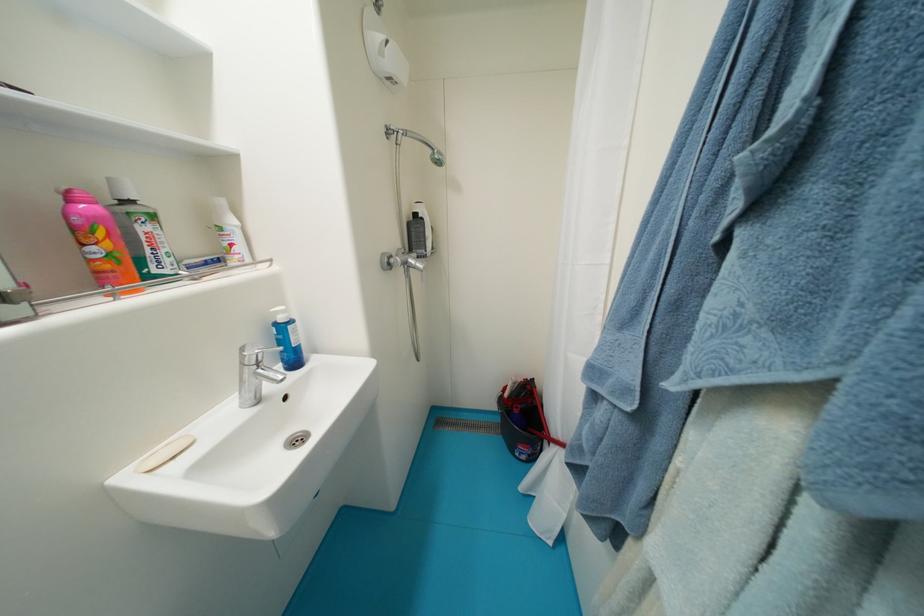
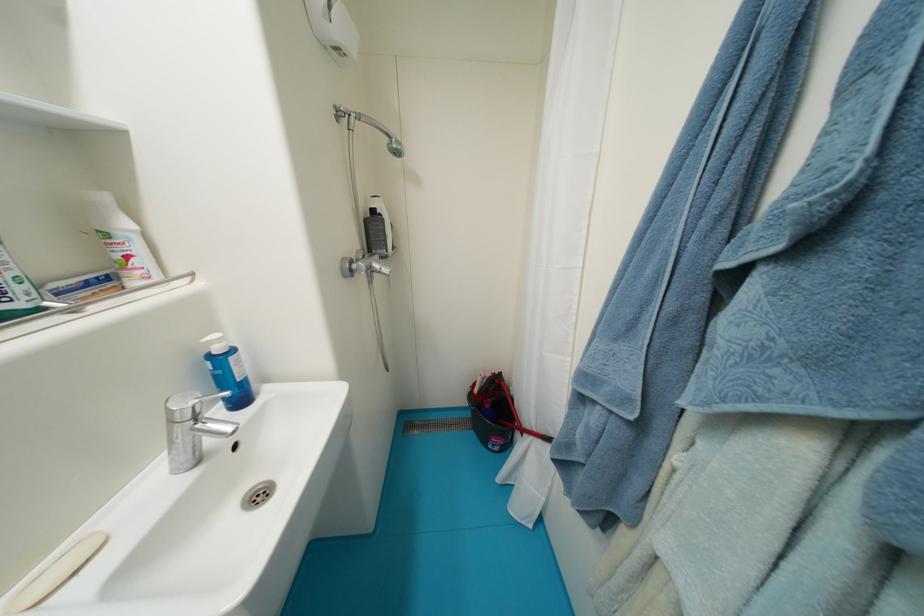
The point at (418,262) is marked in the first image. Where is the corresponding point in the second image?

(383, 267)